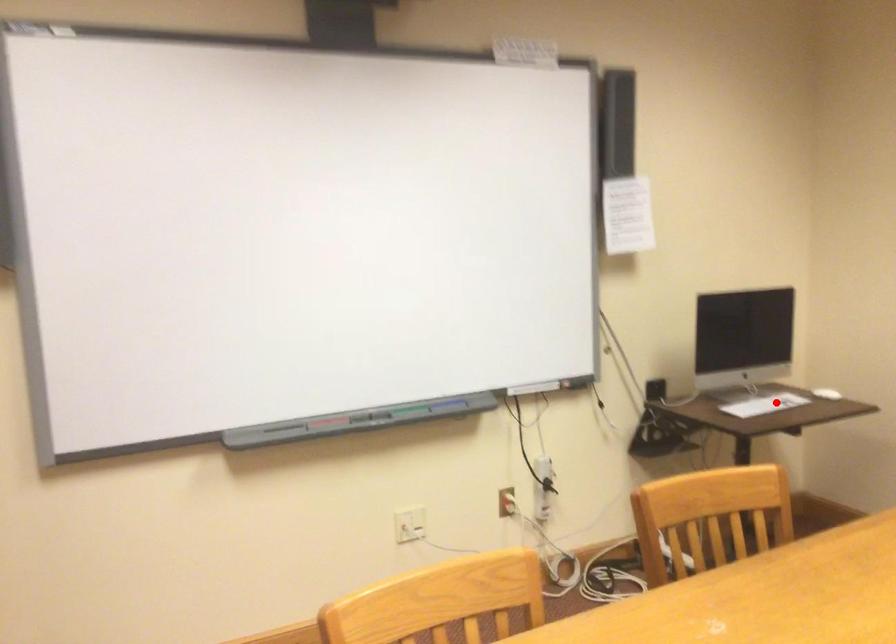
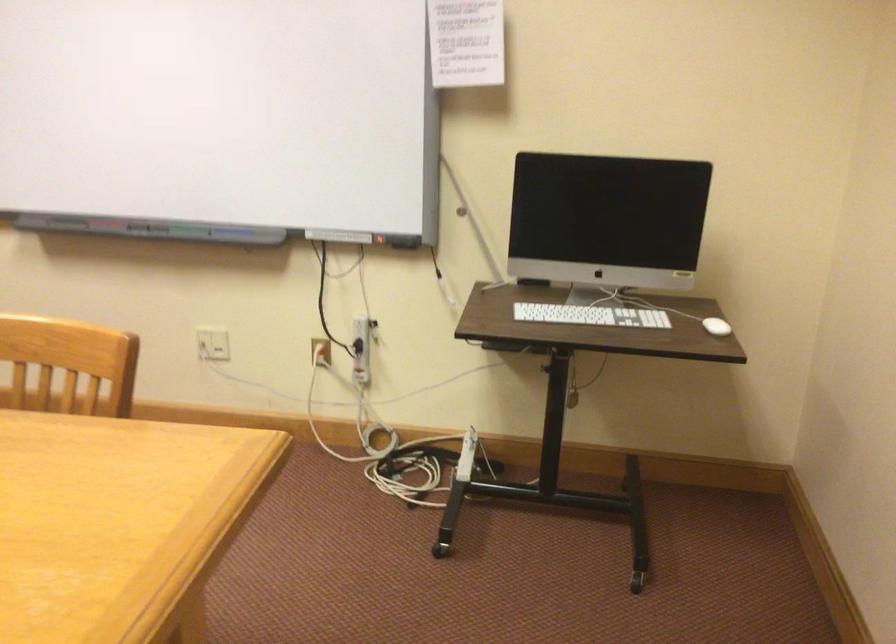
The point at the highlighted location is marked in the first image. Where is the corresponding point in the second image?

(590, 315)